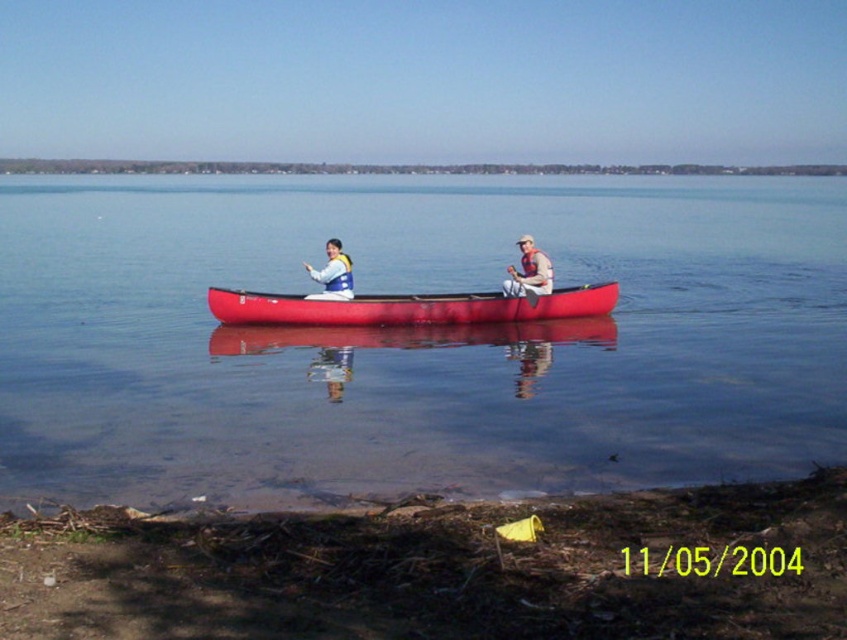
You are planning to store a smooth red canoe at center and a wooden paddle at center in a storage room. The storage room has a shelf that can only accommodate items up to 1.2 meters in width. Based on the scene, will both items fit on the shelf together?

The smooth red canoe at center is wider than the wooden paddle at center. However, since the shelf can only hold items up to 1.2 meters wide, we need to know the exact width of the canoe. Unfortunately, the provided information does not specify the exact width of either item, so we cannot determine if they will fit together on the shelf.

You are standing on the lakeside and see the white life vest at center and the wooden paddle at center in the canoe. Which object is closer to the left side of the canoe?

The white life vest at center is positioned on the left side of the wooden paddle at center, so it is closer to the left side of the canoe.

You are a safety inspector checking the distance between the white life vest at center and the wooden paddle at center in the canoe. According to safety regulations, these items must be no more than 2.5 meters apart for quick access. Is the current arrangement compliant?

The white life vest at center and wooden paddle at center are 3.00 meters apart from each other. Since 3.00 meters exceeds the 2.5 meters maximum allowed by safety regulations, the current arrangement is not compliant.